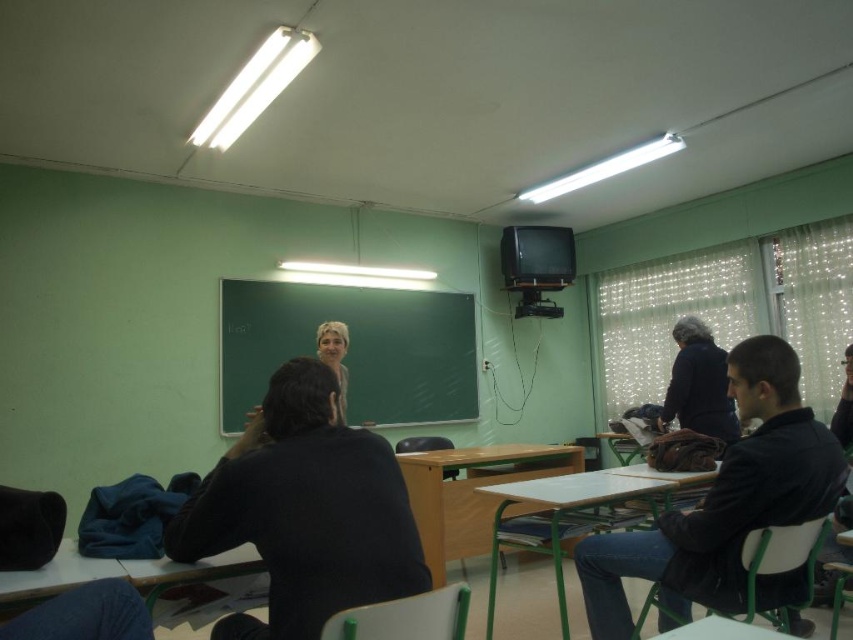
In order to click on black matte jacket at right in this screenshot , I will do (722, 502).

Who is more forward, [801,593] or [482,518]?

Point [801,593] is more forward.

You are a GUI agent. You are given a task and a screenshot of the screen. Output one action in this format:
    pyautogui.click(x=<x>, y=<y>)
    Task: Click on the black matte jacket at right
    Image resolution: width=853 pixels, height=640 pixels.
    Given the screenshot: What is the action you would take?
    pyautogui.click(x=722, y=502)

Does black matte jacket at right have a lesser height compared to dark blue sweater at right?

In fact, black matte jacket at right may be taller than dark blue sweater at right.

The width and height of the screenshot is (853, 640). I want to click on black matte jacket at right, so click(722, 502).

Is point (813, 426) farther from viewer compared to point (677, 371)?

No, (813, 426) is in front of (677, 371).

Image resolution: width=853 pixels, height=640 pixels. What are the coordinates of `black matte jacket at right` in the screenshot? It's located at (722, 502).

Based on the photo, does wooden desk at center have a smaller size compared to blonde hair at center?

No, wooden desk at center is not smaller than blonde hair at center.

Is wooden desk at center positioned at the back of blonde hair at center?

Yes.

Between point (426, 476) and point (328, 348), which one is positioned in front?

Point (328, 348) is in front.

You are a GUI agent. You are given a task and a screenshot of the screen. Output one action in this format:
    pyautogui.click(x=<x>, y=<y>)
    Task: Click on the wooden desk at center
    The width and height of the screenshot is (853, 640).
    Given the screenshot: What is the action you would take?
    pyautogui.click(x=471, y=493)